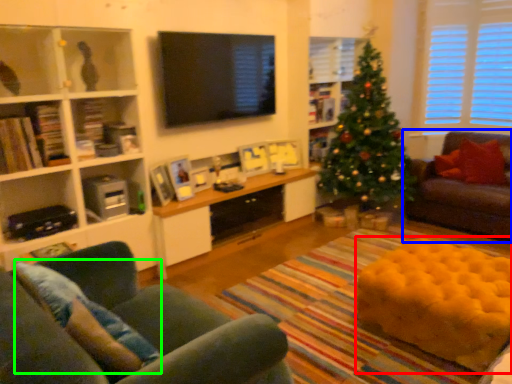
Question: Considering the real-world distances, which object is closest to flat (highlighted by a red box)? studio couch (highlighted by a blue box) or pillow (highlighted by a green box).

Choices:
 (A) studio couch
 (B) pillow

Answer: (A)